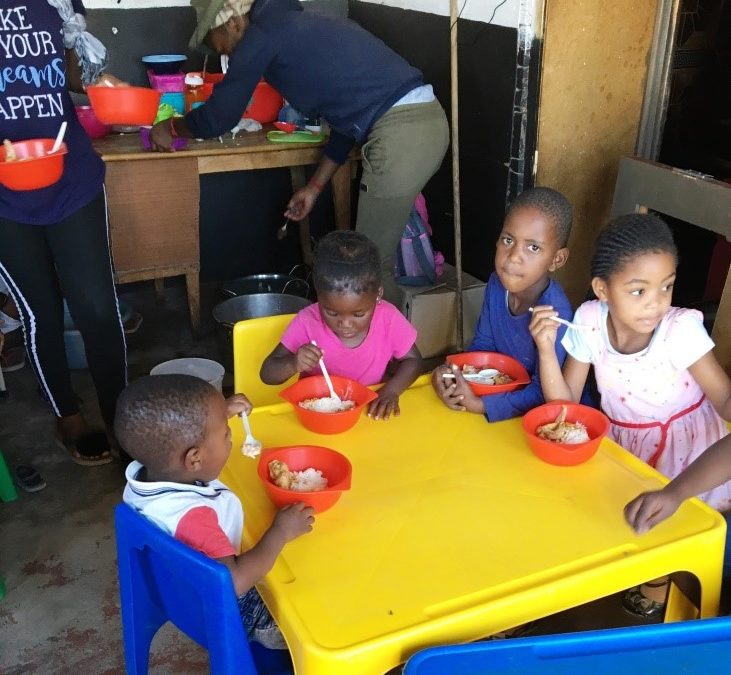
The width and height of the screenshot is (731, 675). Find the location of `spoon`. spoon is located at coordinates (262, 433).